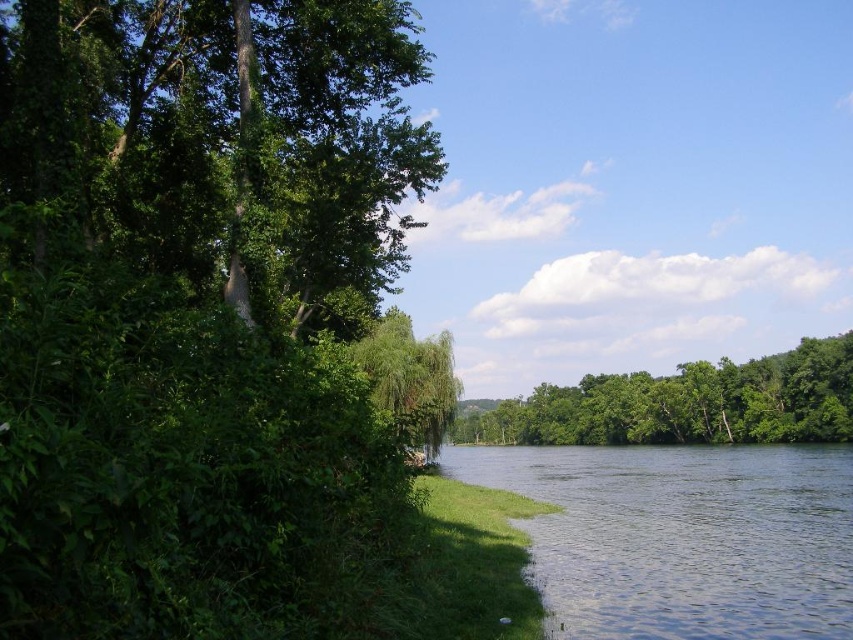
Question: Which point is farther to the camera?

Choices:
 (A) green leafy tree at center
 (B) clear water at lower right

Answer: (A)

Question: Is clear water at lower right thinner than green leafy tree at center?

Choices:
 (A) no
 (B) yes

Answer: (B)

Question: Which object is positioned farthest from the green leafy tree at center?

Choices:
 (A) green leafy tree at left
 (B) clear water at lower right

Answer: (A)

Question: Is green leafy tree at left smaller than green leafy tree at center?

Choices:
 (A) no
 (B) yes

Answer: (B)

Question: Which point is closer to the camera?

Choices:
 (A) (701, 403)
 (B) (97, 90)

Answer: (B)

Question: Is clear water at lower right above green leafy tree at center?

Choices:
 (A) no
 (B) yes

Answer: (B)